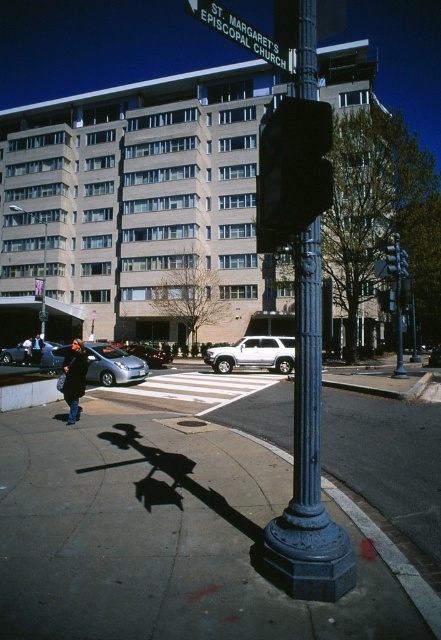
You are a city planner analyzing the street layout. You need to install a new streetlight that must be narrower than the existing blue cast iron pole at center. Can the black plastic traffic light at center serve as a suitable replacement in terms of width?

The blue cast iron pole at center has a larger width than the black plastic traffic light at center, so the black plastic traffic light at center can be a suitable replacement since it is narrower.